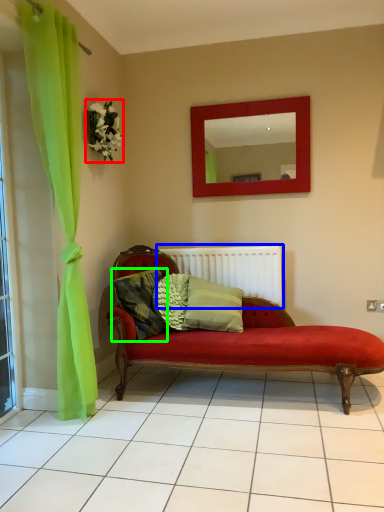
Question: Estimate the real-world distances between objects in this image. Which object is closer to flower (highlighted by a red box), radiator (highlighted by a blue box) or pillow (highlighted by a green box)?

Choices:
 (A) radiator
 (B) pillow

Answer: (B)